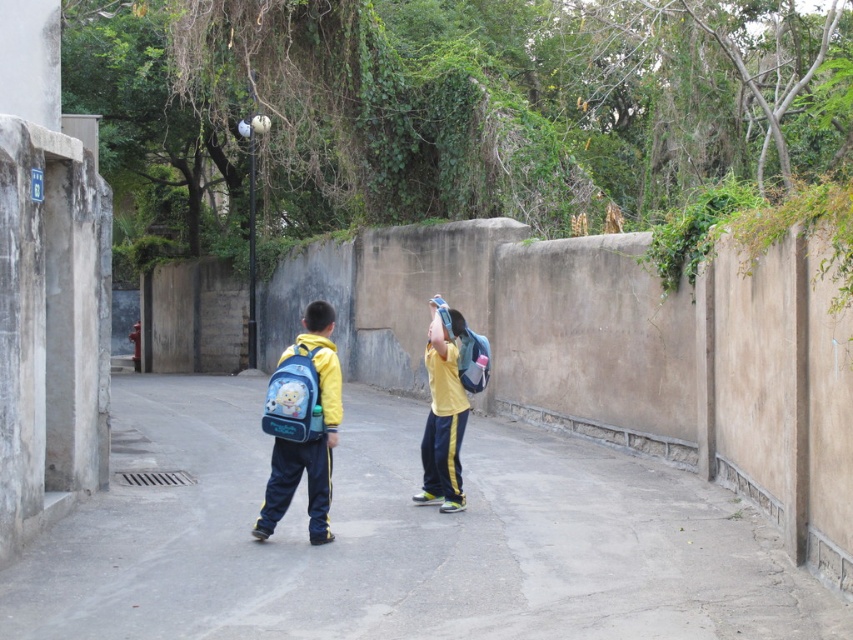
Between point (306, 396) and point (451, 412), which one is positioned behind?

Positioned behind is point (451, 412).

Is blue fabric backpack at center below yellow matte/synthetic uniform at center?

Yes, blue fabric backpack at center is below yellow matte/synthetic uniform at center.

Is point (277, 467) less distant than point (457, 445)?

Yes, it is in front of point (457, 445).

Identify the location of blue fabric backpack at center. (303, 424).

Is matte yellow jacket at center shorter than yellow matte/synthetic uniform at center?

Indeed, matte yellow jacket at center has a lesser height compared to yellow matte/synthetic uniform at center.

Find the location of a particular element. Image resolution: width=853 pixels, height=640 pixels. matte yellow jacket at center is located at coordinates (401, 538).

Image resolution: width=853 pixels, height=640 pixels. What do you see at coordinates (401, 538) in the screenshot?
I see `matte yellow jacket at center` at bounding box center [401, 538].

Identify the location of matte yellow jacket at center. (401, 538).

Does matte yellow jacket at center have a lesser width compared to blue fabric backpack at center?

Incorrect, matte yellow jacket at center's width is not less than blue fabric backpack at center's.

Is matte yellow jacket at center positioned in front of blue fabric backpack at center?

Yes, matte yellow jacket at center is closer to the viewer.

Who is more distant from viewer, (343,586) or (293,419)?

Point (293,419)

The height and width of the screenshot is (640, 853). Identify the location of matte yellow jacket at center. (401, 538).